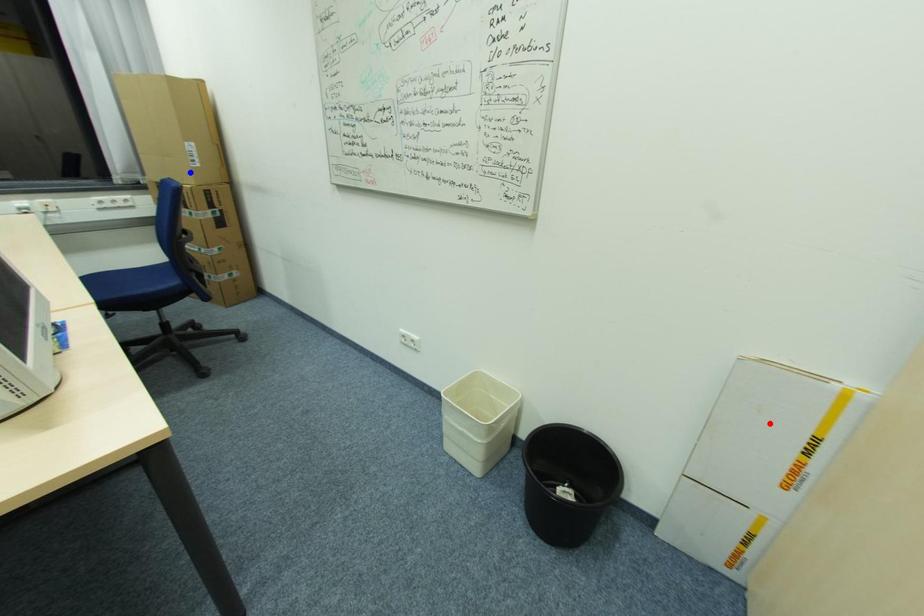
Question: Two points are marked on the image. Which point is closer to the camera?

Choices:
 (A) Blue point is closer.
 (B) Red point is closer.

Answer: (B)